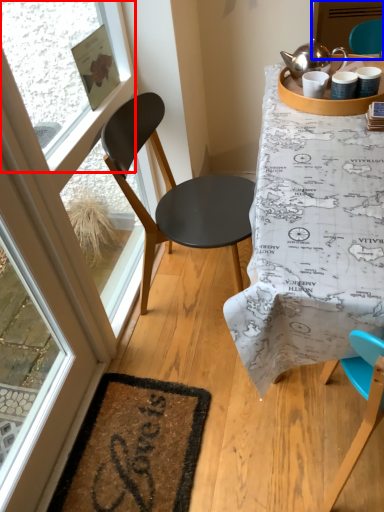
Question: Among these objects, which one is nearest to the camera, window screen (highlighted by a red box) or screen door (highlighted by a blue box)?

Choices:
 (A) window screen
 (B) screen door

Answer: (A)